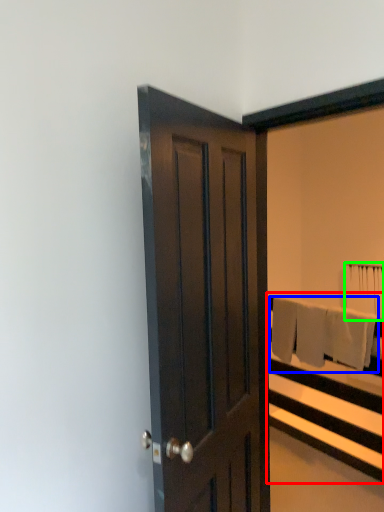
Question: Based on their relative distances, which object is nearer to bed frame (highlighted by a red box)? Choose from bath towel (highlighted by a blue box) and bath towel (highlighted by a green box).

Choices:
 (A) bath towel
 (B) bath towel

Answer: (A)